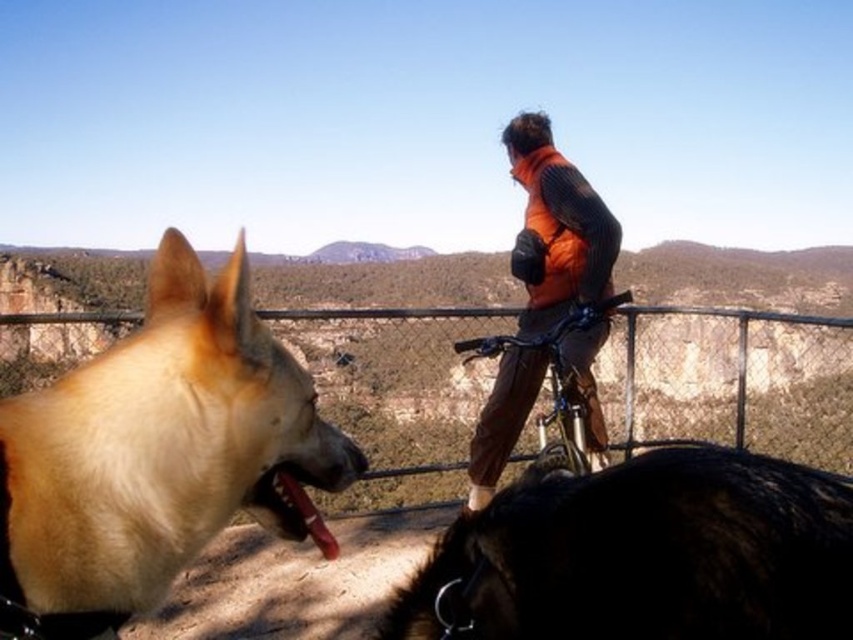
Is black fur dog at lower right bigger than metallic silver bicycle at center?

Yes.

Does point (589, 500) lie behind point (474, 486)?

No, (589, 500) is in front of (474, 486).

Find the location of a particular element. This screenshot has height=640, width=853. black fur dog at lower right is located at coordinates (643, 556).

Which is behind, point (590, 196) or point (316, 516)?

Positioned behind is point (590, 196).

Is point (538, 125) positioned behind point (312, 513)?

Yes, point (538, 125) is farther from viewer.

The height and width of the screenshot is (640, 853). What do you see at coordinates (556, 227) in the screenshot?
I see `orange fleece vest at center` at bounding box center [556, 227].

Find the location of a particular element. The image size is (853, 640). orange fleece vest at center is located at coordinates (556, 227).

Which is behind, point (698, 458) or point (393, 420)?

The point (393, 420) is more distant.

This screenshot has height=640, width=853. I want to click on black fur dog at lower right, so click(x=643, y=556).